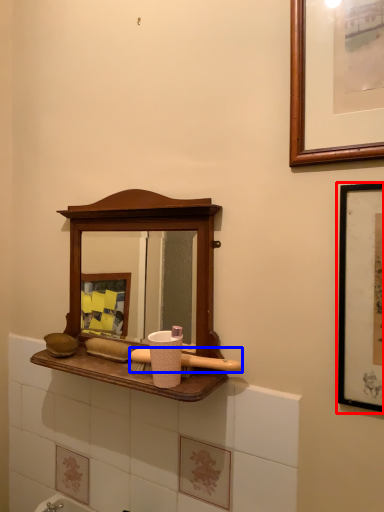
Question: Which point is closer to the camera, picture frame (highlighted by a red box) or brush (highlighted by a blue box)?

Choices:
 (A) picture frame
 (B) brush

Answer: (A)